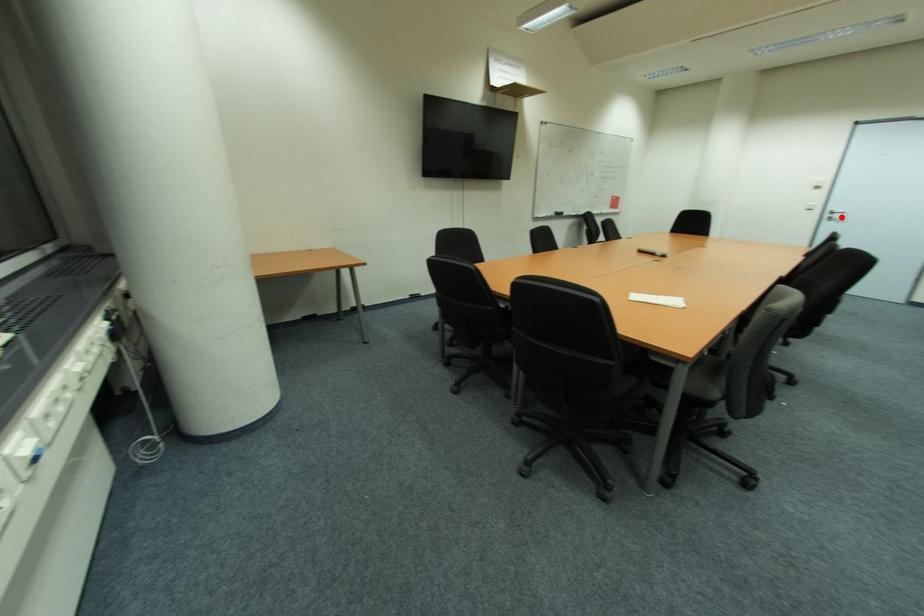
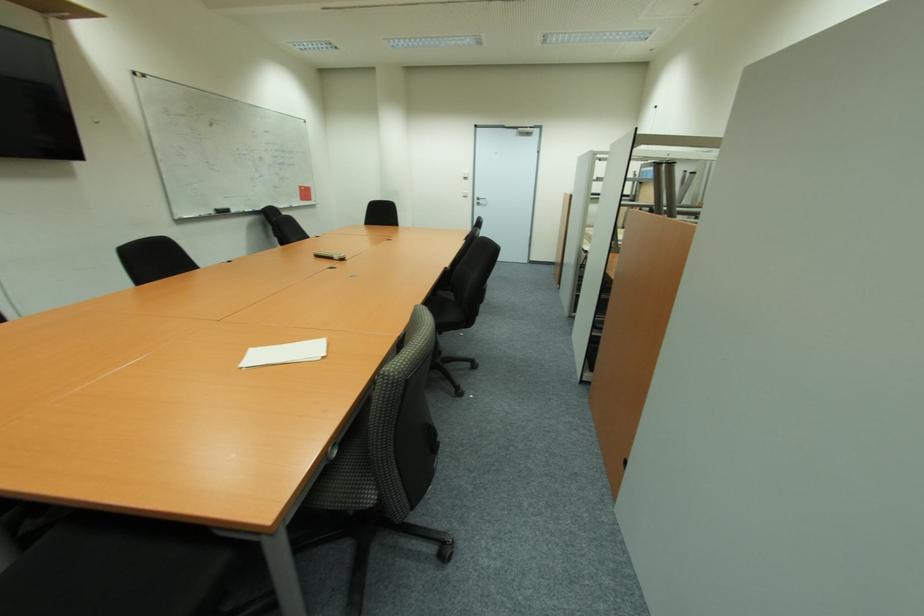
Question: I am providing you with two images of the same scene from different viewpoints. A red point is shown in image1. For the corresponding object point in image2, is it positioned nearer or farther from the camera?

Choices:
 (A) Nearer
 (B) Farther

Answer: (A)